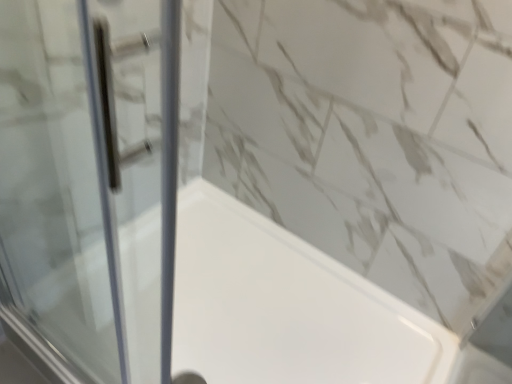
What do you see at coordinates (286, 307) in the screenshot? I see `white glossy bathtub at center` at bounding box center [286, 307].

In order to face white glossy bathtub at center, should I rotate leftwards or rightwards?

A 1.595 degree turn to the left will do.

Where is `white glossy bathtub at center`? The width and height of the screenshot is (512, 384). white glossy bathtub at center is located at coordinates coord(286,307).

The width and height of the screenshot is (512, 384). Find the location of `white glossy bathtub at center`. white glossy bathtub at center is located at coordinates (286, 307).